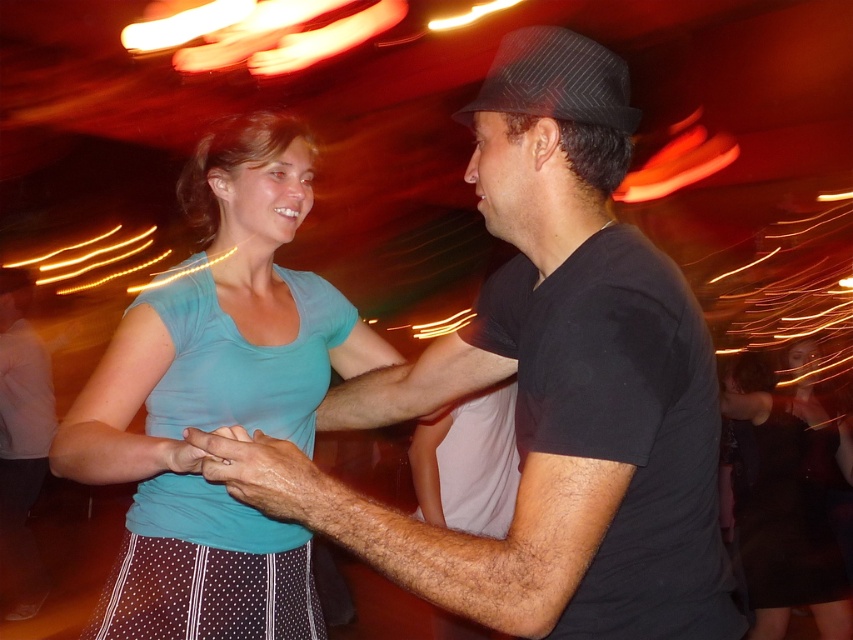
Question: Which point is farther to the camera?

Choices:
 (A) teal fabric skirt at center
 (B) black matte shirt at center
 (C) teal matte shirt at center

Answer: (A)

Question: Estimate the real-world distances between objects in this image. Which object is closer to the teal matte shirt at center?

Choices:
 (A) teal fabric skirt at center
 (B) black matte shirt at center

Answer: (B)

Question: Is teal matte shirt at center wider than teal fabric skirt at center?

Choices:
 (A) yes
 (B) no

Answer: (B)

Question: Based on their relative distances, which object is nearer to the teal fabric skirt at center?

Choices:
 (A) teal matte shirt at center
 (B) black matte shirt at center

Answer: (A)

Question: Can you confirm if black matte shirt at center is positioned above teal matte shirt at center?

Choices:
 (A) no
 (B) yes

Answer: (B)

Question: From the image, what is the correct spatial relationship of teal matte shirt at center in relation to teal fabric skirt at center?

Choices:
 (A) below
 (B) above

Answer: (B)